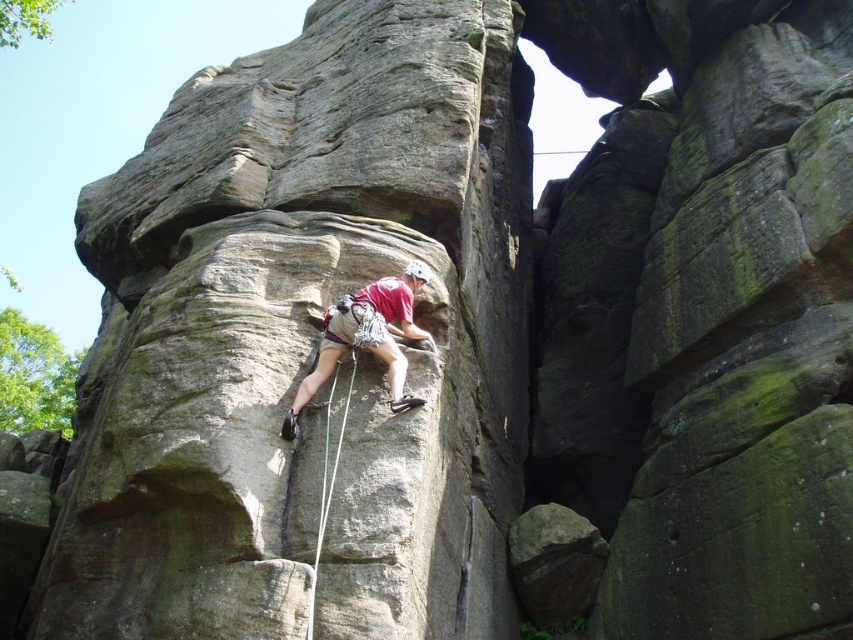
Question: Is matte gray rock climber at center bigger than white nylon rope at center?

Choices:
 (A) yes
 (B) no

Answer: (A)

Question: Observing the image, what is the correct spatial positioning of matte gray rock climber at center in reference to white nylon rope at center?

Choices:
 (A) below
 (B) above

Answer: (B)

Question: Which point is farther to the camera?

Choices:
 (A) (312, 580)
 (B) (314, 380)

Answer: (B)

Question: Considering the relative positions of matte gray rock climber at center and white nylon rope at center in the image provided, where is matte gray rock climber at center located with respect to white nylon rope at center?

Choices:
 (A) left
 (B) right

Answer: (B)